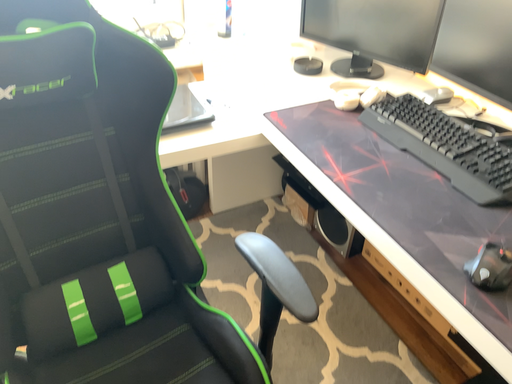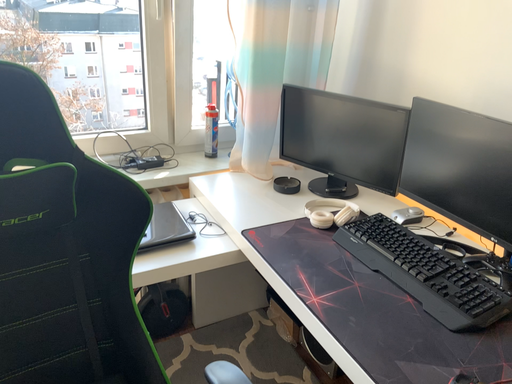
Question: Which way did the camera rotate in the video?

Choices:
 (A) rotated upward
 (B) rotated downward

Answer: (A)